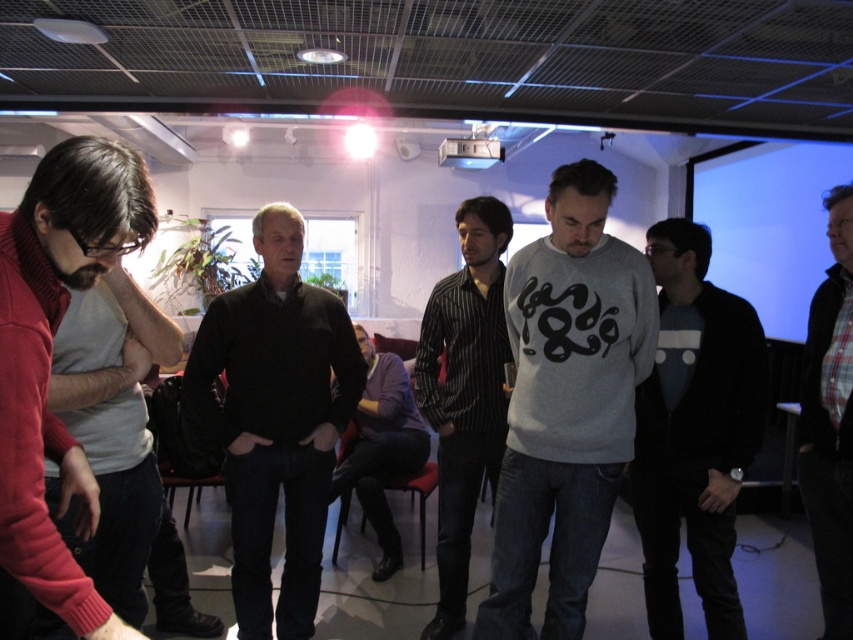
Question: Estimate the real-world distances between objects in this image. Which object is farther from the black striped shirt at center?

Choices:
 (A) purple sweater at center
 (B) gray matte sweater at center

Answer: (A)

Question: Can you confirm if gray matte sweater at center is bigger than black striped shirt at center?

Choices:
 (A) no
 (B) yes

Answer: (A)

Question: Is gray cotton sweatshirt at center above purple sweater at center?

Choices:
 (A) yes
 (B) no

Answer: (A)

Question: Which point is farther to the camera?

Choices:
 (A) gray matte sweater at center
 (B) black striped shirt at center
 (C) matte red sweater at left

Answer: (B)

Question: Which is nearer to the plaid fabric shirt at center?

Choices:
 (A) gray matte sweater at center
 (B) black striped shirt at center
 (C) black matte sweater at center

Answer: (A)

Question: Considering the relative positions of gray cotton sweatshirt at center and gray matte sweater at center in the image provided, where is gray cotton sweatshirt at center located with respect to gray matte sweater at center?

Choices:
 (A) left
 (B) right

Answer: (A)